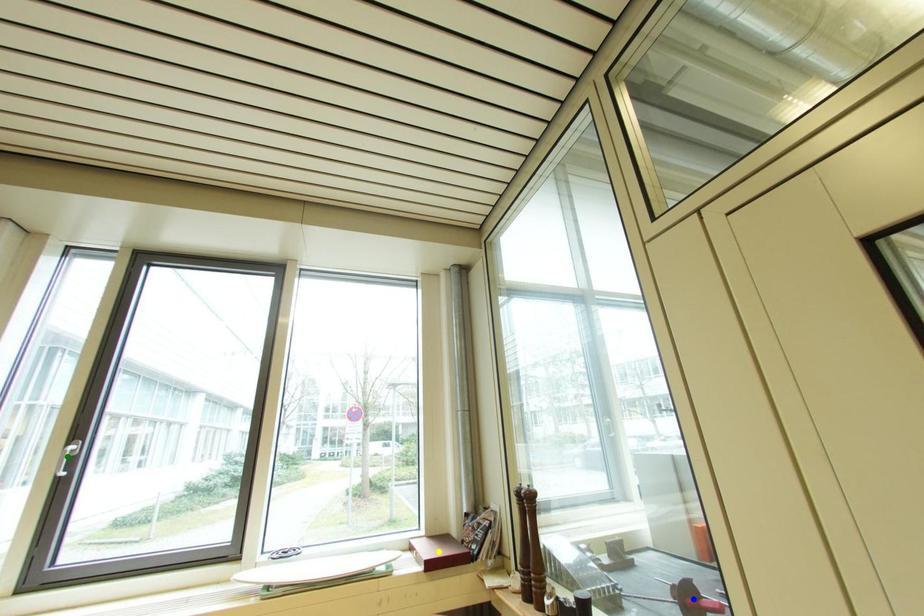
Order these from nearest to farthest:
1. blue point
2. yellow point
3. green point

blue point, green point, yellow point